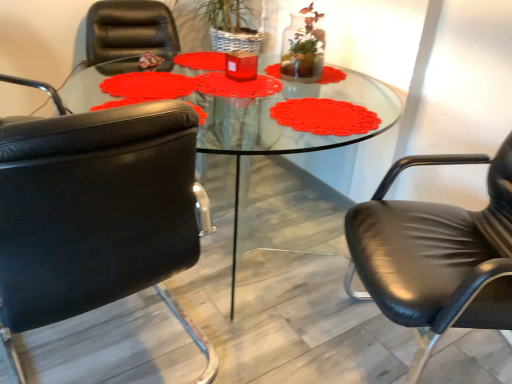
At what (x,y) coordinates should I click in order to perform the action: click on black leather chair at left, the 2th chair in the right-to-left sequence. Please return your answer as a coordinate pair (x, y). Looking at the image, I should click on (97, 215).

Locate an element on the screen. The width and height of the screenshot is (512, 384). transparent glass table at center is located at coordinates (310, 138).

Measure the distance between point [293,74] and camera.

Point [293,74] and camera are 1.80 meters apart from each other.

What is the approximate width of black leather chair at right, which is the 2th chair in left-to-right order?

It is 75.39 centimeters.

Identify the location of black leather chair at left, the first chair from the left. (97, 215).

Which object is positioned more to the right, black leather chair at left, the first chair from the left, or transparent glass table at center?

transparent glass table at center.

From their relative heights in the image, would you say black leather chair at left, the first chair from the left, is taller or shorter than transparent glass table at center?

In the image, black leather chair at left, the first chair from the left, appears to be taller than transparent glass table at center.

Which of these two, black leather chair at left, the first chair from the left, or transparent glass table at center, is thinner?

black leather chair at left, the first chair from the left, is thinner.

Is black leather chair at left, the 2th chair in the right-to-left sequence, next to transparent glass table at center?

They are not placed beside each other.

Based on the photo, can you confirm if transparent glass table at center is positioned to the left of translucent glass vase at upper center?

Correct, you'll find transparent glass table at center to the left of translucent glass vase at upper center.

Is transparent glass table at center not inside translucent glass vase at upper center?

Yes, transparent glass table at center is not within translucent glass vase at upper center.

In terms of size, does transparent glass table at center appear bigger or smaller than translucent glass vase at upper center?

Considering their sizes, transparent glass table at center takes up more space than translucent glass vase at upper center.

Is transparent glass table at center facing away from translucent glass vase at upper center?

No, translucent glass vase at upper center is not at the back of transparent glass table at center.

Does point (143, 116) come closer to viewer compared to point (298, 42)?

Yes, it is in front of point (298, 42).

From the image's perspective, between black leather chair at left, the first chair from the left, and translucent glass vase at upper center, who is located below?

black leather chair at left, the first chair from the left, is shown below in the image.

Can you confirm if black leather chair at left, the first chair from the left, is wider than translucent glass vase at upper center?

Yes.

From a real-world perspective, between black leather chair at left, the first chair from the left, and translucent glass vase at upper center, who is vertically higher?

translucent glass vase at upper center, from a real-world perspective.

From a real-world perspective, is translucent glass vase at upper center under transparent glass table at center?

No.

Can you tell me how much translucent glass vase at upper center and transparent glass table at center differ in facing direction?

The facing directions of translucent glass vase at upper center and transparent glass table at center are 0.000365 degrees apart.

Which of these two, translucent glass vase at upper center or transparent glass table at center, stands shorter?

With less height is translucent glass vase at upper center.

From the image's perspective, which is above, translucent glass vase at upper center or transparent glass table at center?

translucent glass vase at upper center is shown above in the image.

Image resolution: width=512 pixels, height=384 pixels. In the image, there is a black leather chair at left, the first chair from the left. Identify the location of chair below it (from the image's perspective). (437, 255).

From their relative heights in the image, would you say black leather chair at left, the first chair from the left, is taller or shorter than black leather chair at right, which is the 2th chair in left-to-right order?

Clearly, black leather chair at left, the first chair from the left, is shorter compared to black leather chair at right, which is the 2th chair in left-to-right order.

Consider the image. Can you confirm if black leather chair at left, the 2th chair in the right-to-left sequence, is bigger than black leather chair at right, marked as the first chair in a right-to-left arrangement?

Incorrect, black leather chair at left, the 2th chair in the right-to-left sequence, is not larger than black leather chair at right, marked as the first chair in a right-to-left arrangement.

In the scene shown: Which is closer to the camera, (199, 196) or (467, 160)?

Point (199, 196) is positioned farther from the camera compared to point (467, 160).

Does transparent glass table at center come in front of black leather chair at right, which is the 2th chair in left-to-right order?

No, it is not.

From the picture: How many degrees apart are the facing directions of transparent glass table at center and black leather chair at right, which is the 2th chair in left-to-right order?

They differ by 122 degrees in their facing directions.

From the image's perspective, which one is positioned higher, transparent glass table at center or black leather chair at right, marked as the first chair in a right-to-left arrangement?

transparent glass table at center, from the image's perspective.

Is transparent glass table at center far away from black leather chair at right, marked as the first chair in a right-to-left arrangement?

transparent glass table at center is positioned a significant distance from black leather chair at right, marked as the first chair in a right-to-left arrangement.

Can you confirm if black leather chair at right, which is the 2th chair in left-to-right order, is smaller than transparent glass table at center?

Yes, black leather chair at right, which is the 2th chair in left-to-right order, is smaller than transparent glass table at center.

Is black leather chair at right, which is the 2th chair in left-to-right order, further to camera compared to transparent glass table at center?

No, black leather chair at right, which is the 2th chair in left-to-right order, is closer to the camera.

Is black leather chair at right, which is the 2th chair in left-to-right order, not close to transparent glass table at center?

Yes, black leather chair at right, which is the 2th chair in left-to-right order, and transparent glass table at center are quite far apart.

Image resolution: width=512 pixels, height=384 pixels. I want to click on coffee table above the black leather chair at left, the first chair from the left (from the image's perspective), so click(x=310, y=138).

Identify the location of floral arrangement above the transparent glass table at center (from a real-world perspective). (303, 47).

Based on their spatial positions, is translucent glass vase at upper center or transparent glass table at center closer to black leather chair at right, which is the 2th chair in left-to-right order?

translucent glass vase at upper center lies closer to black leather chair at right, which is the 2th chair in left-to-right order, than the other object.

Looking at the image, which one is located further to transparent glass table at center, translucent glass vase at upper center or black leather chair at left, the 2th chair in the right-to-left sequence?

black leather chair at left, the 2th chair in the right-to-left sequence, is positioned further to the anchor transparent glass table at center.

When comparing their distances from translucent glass vase at upper center, does black leather chair at right, which is the 2th chair in left-to-right order, or transparent glass table at center seem closer?

transparent glass table at center is closer to translucent glass vase at upper center.

Estimate the real-world distances between objects in this image. Which object is closer to black leather chair at left, the 2th chair in the right-to-left sequence, black leather chair at right, which is the 2th chair in left-to-right order, or transparent glass table at center?

black leather chair at right, which is the 2th chair in left-to-right order, lies closer to black leather chair at left, the 2th chair in the right-to-left sequence, than the other object.

From the image, which object appears to be nearer to translucent glass vase at upper center, black leather chair at right, marked as the first chair in a right-to-left arrangement, or black leather chair at left, the first chair from the left?

black leather chair at right, marked as the first chair in a right-to-left arrangement, lies closer to translucent glass vase at upper center than the other object.

Estimate the real-world distances between objects in this image. Which object is closer to black leather chair at right, which is the 2th chair in left-to-right order, transparent glass table at center or translucent glass vase at upper center?

Among the two, translucent glass vase at upper center is located nearer to black leather chair at right, which is the 2th chair in left-to-right order.

From the image, which object appears to be nearer to black leather chair at right, marked as the first chair in a right-to-left arrangement, transparent glass table at center or black leather chair at left, the first chair from the left?

black leather chair at left, the first chair from the left.

Estimate the real-world distances between objects in this image. Which object is closer to transparent glass table at center, translucent glass vase at upper center or black leather chair at right, marked as the first chair in a right-to-left arrangement?

The object closer to transparent glass table at center is translucent glass vase at upper center.

Image resolution: width=512 pixels, height=384 pixels. I want to click on coffee table between black leather chair at left, the 2th chair in the right-to-left sequence, and black leather chair at right, which is the 2th chair in left-to-right order, so click(x=310, y=138).

Identify the location of coffee table between black leather chair at left, the first chair from the left, and translucent glass vase at upper center, along the z-axis. This screenshot has width=512, height=384. (x=310, y=138).

Image resolution: width=512 pixels, height=384 pixels. I want to click on floral arrangement located between black leather chair at left, the first chair from the left, and black leather chair at right, marked as the first chair in a right-to-left arrangement, in the left-right direction, so click(x=303, y=47).

The image size is (512, 384). Find the location of `coffee table positioned between black leather chair at right, which is the 2th chair in left-to-right order, and translucent glass vase at upper center from near to far`. coffee table positioned between black leather chair at right, which is the 2th chair in left-to-right order, and translucent glass vase at upper center from near to far is located at coordinates (310, 138).